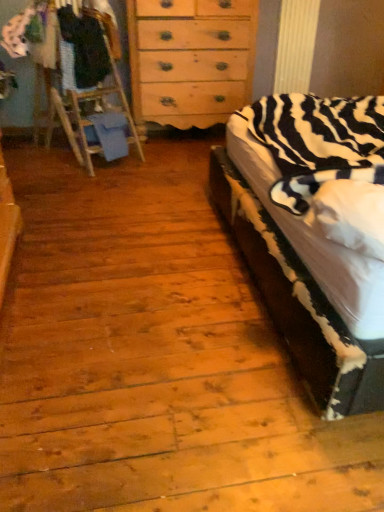
This screenshot has height=512, width=384. What do you see at coordinates (17, 33) in the screenshot?
I see `white cotton shirt at upper left, placed as the 2th clothing when sorted from right to left` at bounding box center [17, 33].

The image size is (384, 512). I want to click on light brown wooden dresser at center, so click(190, 60).

This screenshot has width=384, height=512. Describe the element at coordinates (303, 231) in the screenshot. I see `zebra-patterned fabric at right` at that location.

Image resolution: width=384 pixels, height=512 pixels. What do you see at coordinates (85, 47) in the screenshot?
I see `dark blue fabric at left, the 2th clothing when ordered from left to right` at bounding box center [85, 47].

Where is `white cotton shirt at upper left, arranged as the first clothing when viewed from the left`? The width and height of the screenshot is (384, 512). white cotton shirt at upper left, arranged as the first clothing when viewed from the left is located at coordinates (17, 33).

Is light brown wooden dresser at center located within dark blue fabric at left, the 2th clothing when ordered from left to right?

Definitely not — light brown wooden dresser at center is not inside dark blue fabric at left, the 2th clothing when ordered from left to right.

Where is `the 2nd clothing in front of the light brown wooden dresser at center, counting from the anchor's position`? The height and width of the screenshot is (512, 384). the 2nd clothing in front of the light brown wooden dresser at center, counting from the anchor's position is located at coordinates (x=85, y=47).

Considering the sizes of objects dark blue fabric at left, the 1th clothing from the right, and light brown wooden dresser at center in the image provided, who is thinner, dark blue fabric at left, the 1th clothing from the right, or light brown wooden dresser at center?

Thinner between the two is dark blue fabric at left, the 1th clothing from the right.

Which point is more forward, (87, 64) or (243, 94)?

The point (87, 64) is more forward.

From a real-world perspective, is light brown wooden dresser at center below white cotton shirt at upper left, arranged as the first clothing when viewed from the left?

Indeed, from a real-world perspective, light brown wooden dresser at center is positioned beneath white cotton shirt at upper left, arranged as the first clothing when viewed from the left.

Considering the sizes of light brown wooden dresser at center and white cotton shirt at upper left, arranged as the first clothing when viewed from the left, in the image, is light brown wooden dresser at center taller or shorter than white cotton shirt at upper left, arranged as the first clothing when viewed from the left,?

light brown wooden dresser at center is taller than white cotton shirt at upper left, arranged as the first clothing when viewed from the left.

In the scene shown: Considering their positions, is light brown wooden dresser at center located in front of or behind white cotton shirt at upper left, arranged as the first clothing when viewed from the left?

light brown wooden dresser at center is behind white cotton shirt at upper left, arranged as the first clothing when viewed from the left.

Considering the relative positions of white cotton shirt at upper left, arranged as the first clothing when viewed from the left, and zebra-patterned fabric at right in the image provided, is white cotton shirt at upper left, arranged as the first clothing when viewed from the left, to the left of zebra-patterned fabric at right from the viewer's perspective?

Yes.

Does white cotton shirt at upper left, placed as the 2th clothing when sorted from right to left, come behind zebra-patterned fabric at right?

Yes, white cotton shirt at upper left, placed as the 2th clothing when sorted from right to left, is further from the camera.

From a real-world perspective, which is physically above, white cotton shirt at upper left, arranged as the first clothing when viewed from the left, or zebra-patterned fabric at right?

In real-world perspective, white cotton shirt at upper left, arranged as the first clothing when viewed from the left, is above.

Between white cotton shirt at upper left, arranged as the first clothing when viewed from the left, and zebra-patterned fabric at right, which one has smaller width?

Thinner between the two is white cotton shirt at upper left, arranged as the first clothing when viewed from the left.

Who is bigger, zebra-patterned fabric at right or light brown wooden dresser at center?

Bigger between the two is zebra-patterned fabric at right.

Could you tell me if zebra-patterned fabric at right is facing light brown wooden dresser at center?

No, zebra-patterned fabric at right is not oriented towards light brown wooden dresser at center.

Which object is positioned more to the left, zebra-patterned fabric at right or light brown wooden dresser at center?

light brown wooden dresser at center is more to the left.

Is zebra-patterned fabric at right positioned with its back to dark blue fabric at left, the 1th clothing from the right?

No, zebra-patterned fabric at right's orientation is not away from dark blue fabric at left, the 1th clothing from the right.

Which is more to the right, zebra-patterned fabric at right or dark blue fabric at left, the 1th clothing from the right?

Positioned to the right is zebra-patterned fabric at right.

Is point (357, 105) closer to viewer compared to point (62, 27)?

Yes, it is in front of point (62, 27).

Considering the relative positions of zebra-patterned fabric at right and dark blue fabric at left, the 2th clothing when ordered from left to right, in the image provided, is zebra-patterned fabric at right in front of dark blue fabric at left, the 2th clothing when ordered from left to right,?

That is True.

From the image's perspective, is light brown wooden dresser at center positioned above or below zebra-patterned fabric at right?

From the image's perspective, light brown wooden dresser at center appears above zebra-patterned fabric at right.

Consider the image. Relative to zebra-patterned fabric at right, is light brown wooden dresser at center in front or behind?

Clearly, light brown wooden dresser at center is behind zebra-patterned fabric at right.

I want to click on chest of drawers above the zebra-patterned fabric at right (from the image's perspective), so click(190, 60).

Between point (198, 103) and point (348, 362), which one is positioned in front?

Point (348, 362)

Does white cotton shirt at upper left, arranged as the first clothing when viewed from the left, have a greater width compared to light brown wooden dresser at center?

In fact, white cotton shirt at upper left, arranged as the first clothing when viewed from the left, might be narrower than light brown wooden dresser at center.

Is white cotton shirt at upper left, placed as the 2th clothing when sorted from right to left, inside the boundaries of light brown wooden dresser at center, or outside?

white cotton shirt at upper left, placed as the 2th clothing when sorted from right to left, is located beyond the bounds of light brown wooden dresser at center.

Does white cotton shirt at upper left, arranged as the first clothing when viewed from the left, turn towards light brown wooden dresser at center?

Yes, white cotton shirt at upper left, arranged as the first clothing when viewed from the left, is aimed at light brown wooden dresser at center.

Is white cotton shirt at upper left, placed as the 2th clothing when sorted from right to left, positioned behind light brown wooden dresser at center?

No, the depth of white cotton shirt at upper left, placed as the 2th clothing when sorted from right to left, is less than that of light brown wooden dresser at center.

The width and height of the screenshot is (384, 512). What are the coordinates of `chest of drawers below the dark blue fabric at left, the 1th clothing from the right (from a real-world perspective)` in the screenshot? It's located at [x=190, y=60].

At what (x,y) coordinates should I click in order to perform the action: click on the 1st clothing in front of the light brown wooden dresser at center. Please return your answer as a coordinate pair (x, y). The height and width of the screenshot is (512, 384). Looking at the image, I should click on (17, 33).

Which object lies further to the anchor point light brown wooden dresser at center, zebra-patterned fabric at right or white cotton shirt at upper left, arranged as the first clothing when viewed from the left?

zebra-patterned fabric at right.

When comparing their distances from white cotton shirt at upper left, arranged as the first clothing when viewed from the left, does light brown wooden dresser at center or dark blue fabric at left, the 2th clothing when ordered from left to right, seem further?

The object further to white cotton shirt at upper left, arranged as the first clothing when viewed from the left, is light brown wooden dresser at center.

From the picture: When comparing their distances from dark blue fabric at left, the 2th clothing when ordered from left to right, does zebra-patterned fabric at right or light brown wooden dresser at center seem closer?

The object closer to dark blue fabric at left, the 2th clothing when ordered from left to right, is light brown wooden dresser at center.

Estimate the real-world distances between objects in this image. Which object is further from dark blue fabric at left, the 2th clothing when ordered from left to right, light brown wooden dresser at center or white cotton shirt at upper left, placed as the 2th clothing when sorted from right to left?

light brown wooden dresser at center is further to dark blue fabric at left, the 2th clothing when ordered from left to right.

Which object lies further to the anchor point light brown wooden dresser at center, dark blue fabric at left, the 2th clothing when ordered from left to right, or zebra-patterned fabric at right?

Among the two, zebra-patterned fabric at right is located further to light brown wooden dresser at center.

Estimate the real-world distances between objects in this image. Which object is closer to zebra-patterned fabric at right, dark blue fabric at left, the 1th clothing from the right, or white cotton shirt at upper left, placed as the 2th clothing when sorted from right to left?

dark blue fabric at left, the 1th clothing from the right.

Looking at the image, which one is located further to zebra-patterned fabric at right, dark blue fabric at left, the 1th clothing from the right, or light brown wooden dresser at center?

dark blue fabric at left, the 1th clothing from the right, lies further to zebra-patterned fabric at right than the other object.

Considering their positions, is zebra-patterned fabric at right positioned closer to white cotton shirt at upper left, arranged as the first clothing when viewed from the left, than dark blue fabric at left, the 2th clothing when ordered from left to right?

dark blue fabric at left, the 2th clothing when ordered from left to right, lies closer to white cotton shirt at upper left, arranged as the first clothing when viewed from the left, than the other object.

Find the location of `clothing located between white cotton shirt at upper left, placed as the 2th clothing when sorted from right to left, and zebra-patterned fabric at right in the left-right direction`. clothing located between white cotton shirt at upper left, placed as the 2th clothing when sorted from right to left, and zebra-patterned fabric at right in the left-right direction is located at coordinates (85, 47).

Find the location of a particular element. clothing between white cotton shirt at upper left, placed as the 2th clothing when sorted from right to left, and light brown wooden dresser at center, in the horizontal direction is located at coordinates (85, 47).